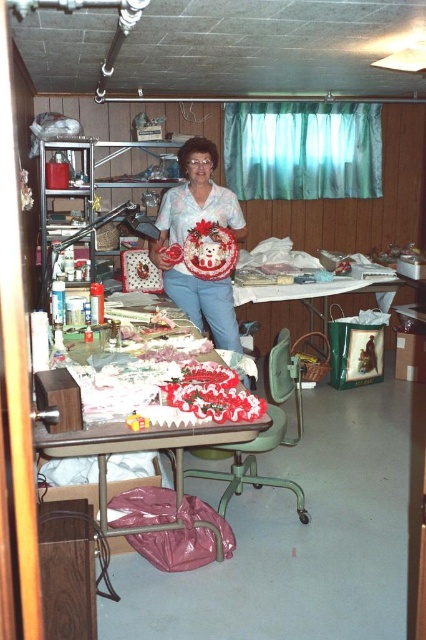
Is matte white fabric at center to the right of metallic silver table at center from the viewer's perspective?

In fact, matte white fabric at center is to the left of metallic silver table at center.

Which is behind, point (178, 269) or point (325, 310)?

Point (325, 310)

Between point (183, 182) and point (325, 326), which one is positioned behind?

The point (325, 326) is more distant.

Locate an element on the screen. The height and width of the screenshot is (640, 426). matte white fabric at center is located at coordinates (186, 236).

Image resolution: width=426 pixels, height=640 pixels. What do you see at coordinates (143, 449) in the screenshot?
I see `wooden table at center` at bounding box center [143, 449].

Does wooden table at center have a greater width compared to metallic silver table at center?

No.

Who is more distant from viewer, [154,444] or [345,312]?

The point [345,312] is behind.

The height and width of the screenshot is (640, 426). I want to click on wooden table at center, so click(x=143, y=449).

Does matte white fabric at center have a larger size compared to wooden table at center?

Actually, matte white fabric at center might be smaller than wooden table at center.

Is matte white fabric at center below wooden table at center?

Actually, matte white fabric at center is above wooden table at center.

The image size is (426, 640). Describe the element at coordinates (186, 236) in the screenshot. I see `matte white fabric at center` at that location.

Locate an element on the screen. This screenshot has height=640, width=426. matte white fabric at center is located at coordinates click(186, 236).